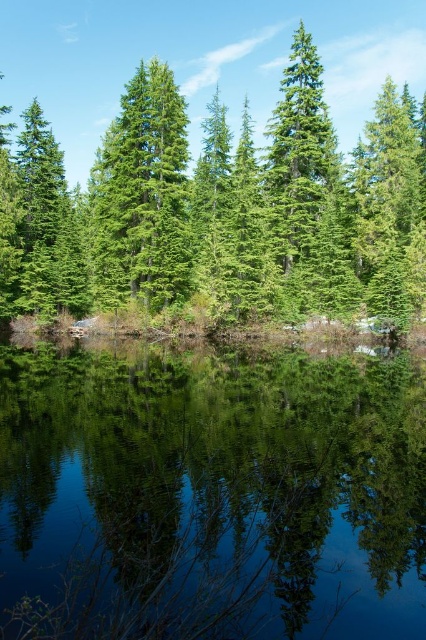
Question: Which point appears farthest from the camera in this image?

Choices:
 (A) (249, 275)
 (B) (149, 152)

Answer: (B)

Question: Can you confirm if green needle-like trees at center is bigger than green matte tree at center?

Choices:
 (A) yes
 (B) no

Answer: (A)

Question: Considering the relative positions of green reflective water at center and green needle-like trees at center in the image provided, where is green reflective water at center located with respect to green needle-like trees at center?

Choices:
 (A) left
 (B) right

Answer: (B)

Question: Considering the relative positions of green needle-like trees at center and green matte tree at center in the image provided, where is green needle-like trees at center located with respect to green matte tree at center?

Choices:
 (A) left
 (B) right

Answer: (B)

Question: Which object is farther from the camera taking this photo?

Choices:
 (A) green reflective water at center
 (B) green needle-like trees at center

Answer: (B)

Question: Estimate the real-world distances between objects in this image. Which object is farther from the green needle-like trees at center?

Choices:
 (A) green matte tree at center
 (B) green reflective water at center

Answer: (B)